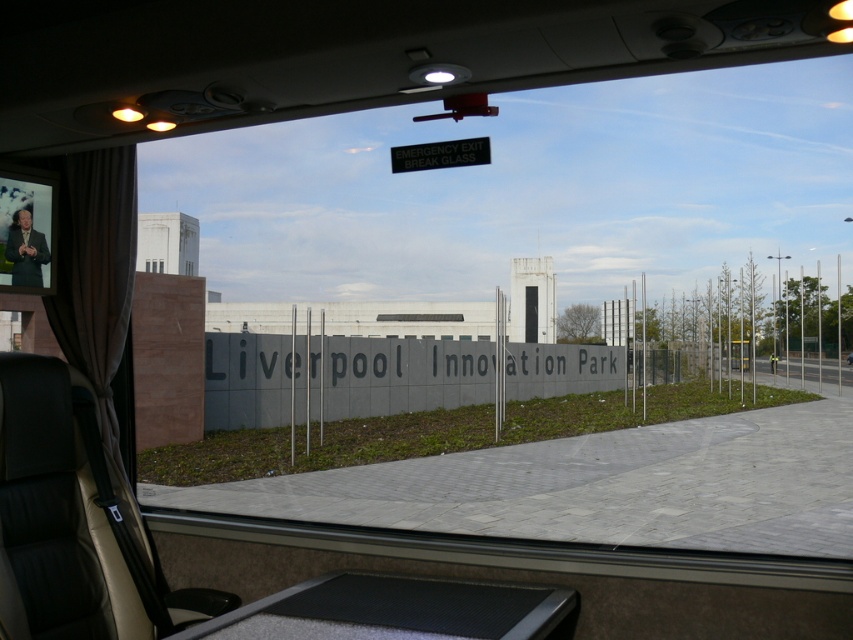
You are inside a vehicle and looking through the window. There is a point marked at coordinates (154,266). What does this point represent?

The point at coordinates (154,266) represents the clear glass window at center.

You are a passenger sitting in the vehicle and want to look outside through the glass. Which glass should you use if you want to have a wider view? Please choose between the clear glass window at center and the transparent glass at center.

The clear glass window at center has a larger size compared to the transparent glass at center, so you should use the clear glass window at center to have a wider view.